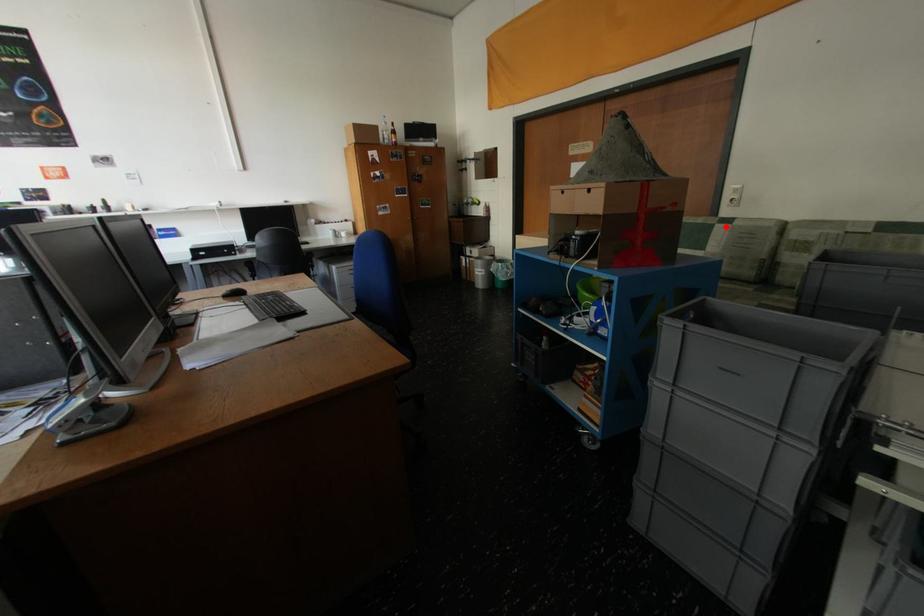
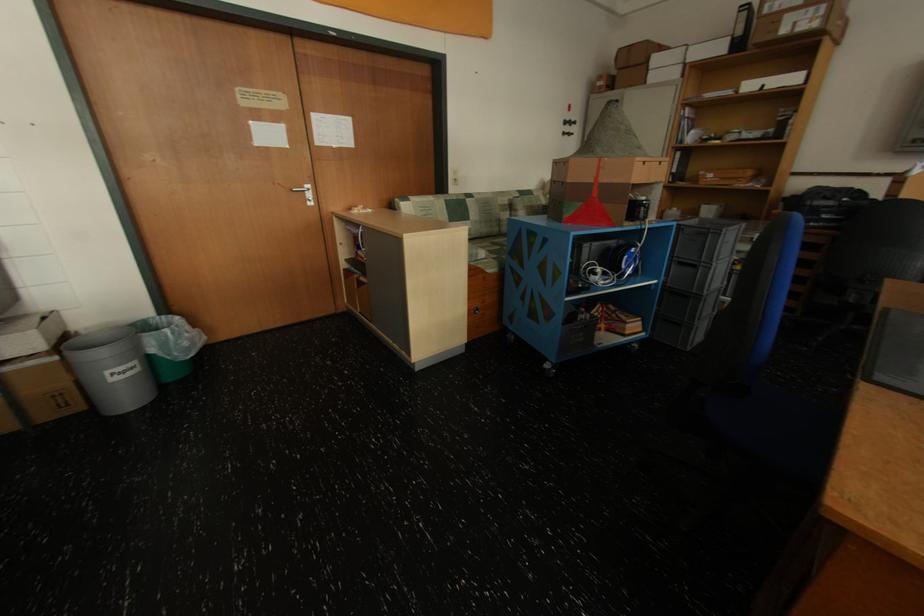
Question: I am providing you with two images of the same scene from different viewpoints. A red point is shown in image1. For the corresponding object point in image2, is it positioned nearer or farther from the camera?

Choices:
 (A) Nearer
 (B) Farther

Answer: (A)